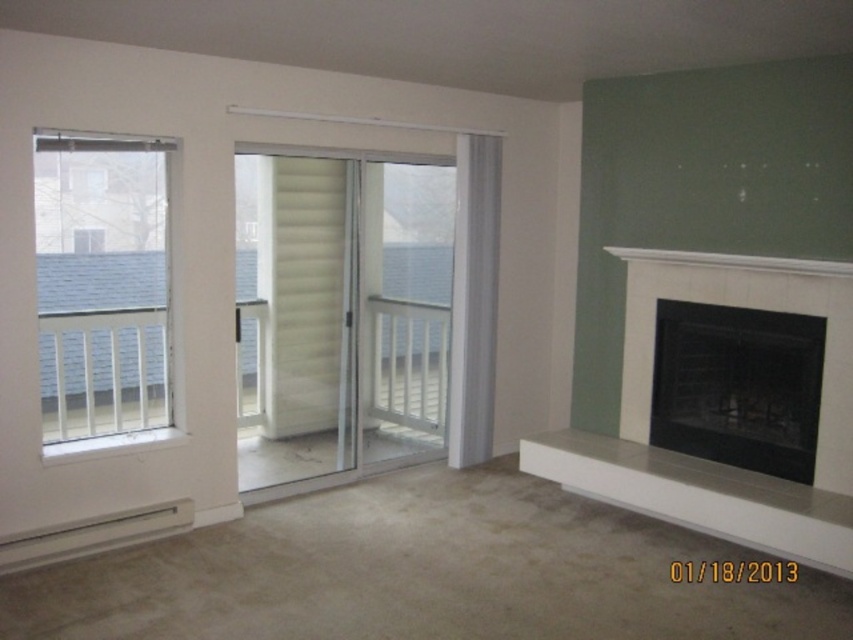
You are a delivery person trying to enter the living room through the sliding doors. You see the clear glass sliding door at center and the white glossy sliding door at center. Which door should you open to enter the room?

The clear glass sliding door at center is positioned over the white glossy sliding door at center, so you should open the clear glass sliding door at center to enter the room since it is the upper door and likely the functional one.

In the scene shown: You are a delivery person entering the living room and need to locate the clear glass sliding door at center. According to the scene, where would you find it relative to the white wood window at left?

The clear glass sliding door at center is located below the white wood window at left.